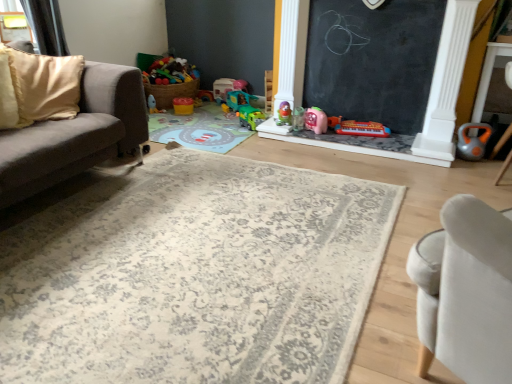
You are a GUI agent. You are given a task and a screenshot of the screen. Output one action in this format:
    pyautogui.click(x=<x>, y=<y>)
    Task: Click on the vacant area that is in front of matte plastic toy at upper center, the 10th toy positioned from the right
    The width and height of the screenshot is (512, 384).
    Given the screenshot: What is the action you would take?
    pyautogui.click(x=159, y=115)